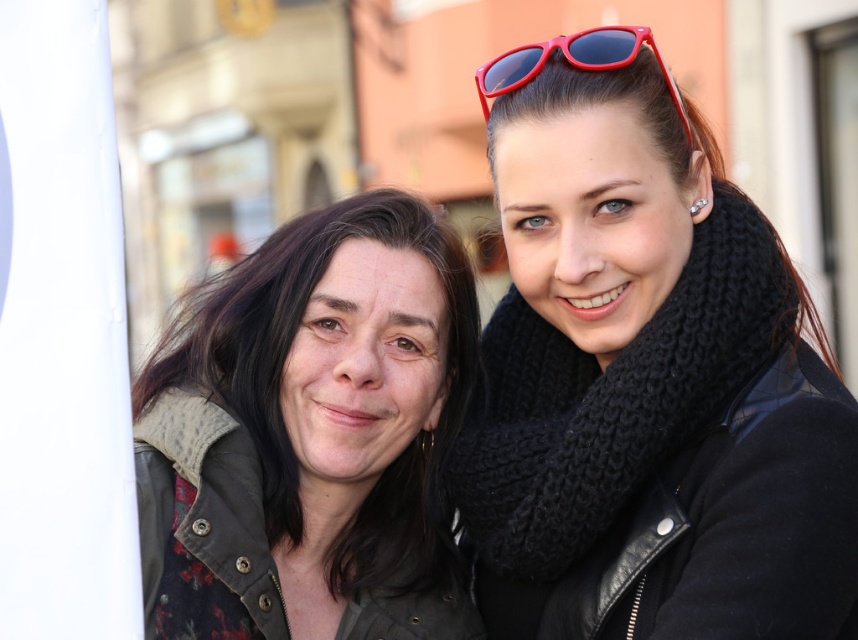
Question: Estimate the real-world distances between objects in this image. Which object is closer to the shiny plastic sunglasses at upper right?

Choices:
 (A) black knitted scarf at upper right
 (B) dark brown leather jacket at center

Answer: (A)

Question: Is black knitted scarf at upper right below shiny plastic sunglasses at upper right?

Choices:
 (A) no
 (B) yes

Answer: (B)

Question: Which object is the farthest from the dark brown leather jacket at center?

Choices:
 (A) black knitted scarf at upper right
 (B) shiny plastic sunglasses at upper right

Answer: (B)

Question: Which point is closer to the camera?

Choices:
 (A) black knitted scarf at upper right
 (B) shiny plastic sunglasses at upper right
 (C) dark brown leather jacket at center

Answer: (C)

Question: Is dark brown leather jacket at center smaller than shiny plastic sunglasses at upper right?

Choices:
 (A) yes
 (B) no

Answer: (B)

Question: Does dark brown leather jacket at center appear on the right side of shiny plastic sunglasses at upper right?

Choices:
 (A) yes
 (B) no

Answer: (B)